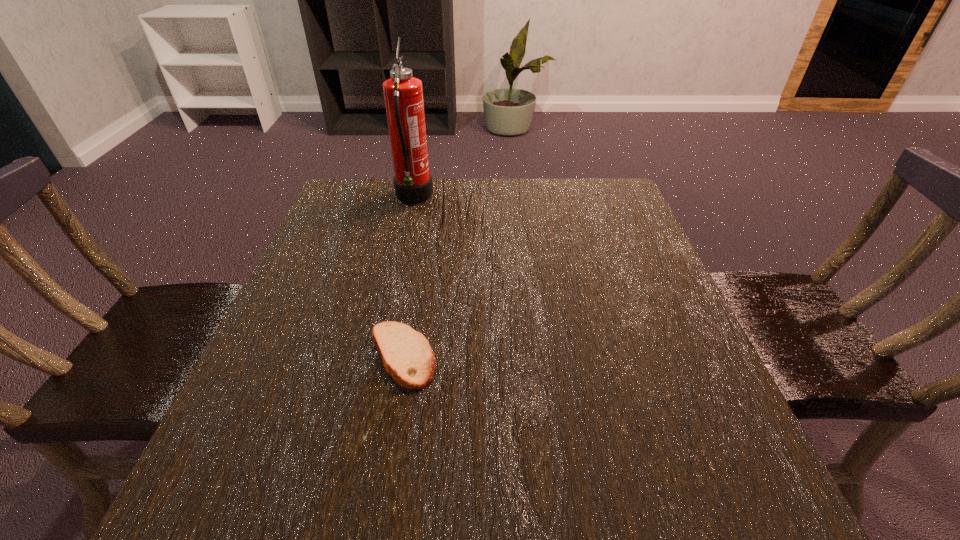
You are a GUI agent. You are given a task and a screenshot of the screen. Output one action in this format:
    pyautogui.click(x=<x>, y=<y>)
    Task: Click on the farther object
    The image size is (960, 540).
    Given the screenshot: What is the action you would take?
    pyautogui.click(x=403, y=94)

Identify the location of fire extinguisher. The width and height of the screenshot is (960, 540). (403, 94).

Where is `the nearer object`? Image resolution: width=960 pixels, height=540 pixels. the nearer object is located at coordinates (406, 354).

In order to click on pita bread in this screenshot , I will do `click(406, 354)`.

Where is `free location located on the front-facing side of the fire extinguisher`? Image resolution: width=960 pixels, height=540 pixels. free location located on the front-facing side of the fire extinguisher is located at coordinates (495, 198).

The image size is (960, 540). In order to click on vacant space located on the front of the shorter object in this screenshot , I will do `click(372, 529)`.

Find the location of `object present at the far edge`. object present at the far edge is located at coordinates (403, 94).

Find the location of a particular element. object located at the left edge is located at coordinates (403, 94).

The image size is (960, 540). Identify the location of object present at the far left corner. (403, 94).

Image resolution: width=960 pixels, height=540 pixels. Identify the location of free space at the far edge of the desktop. (470, 217).